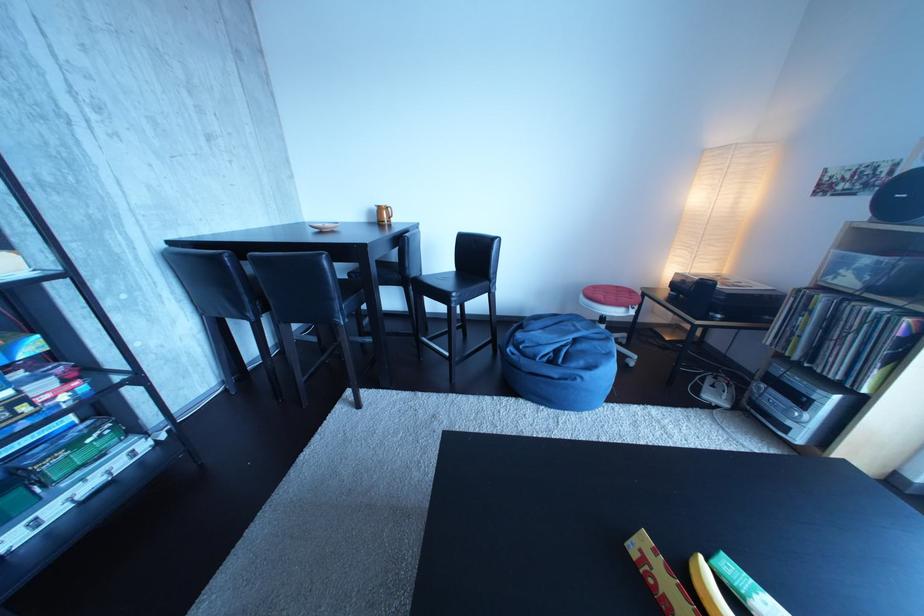
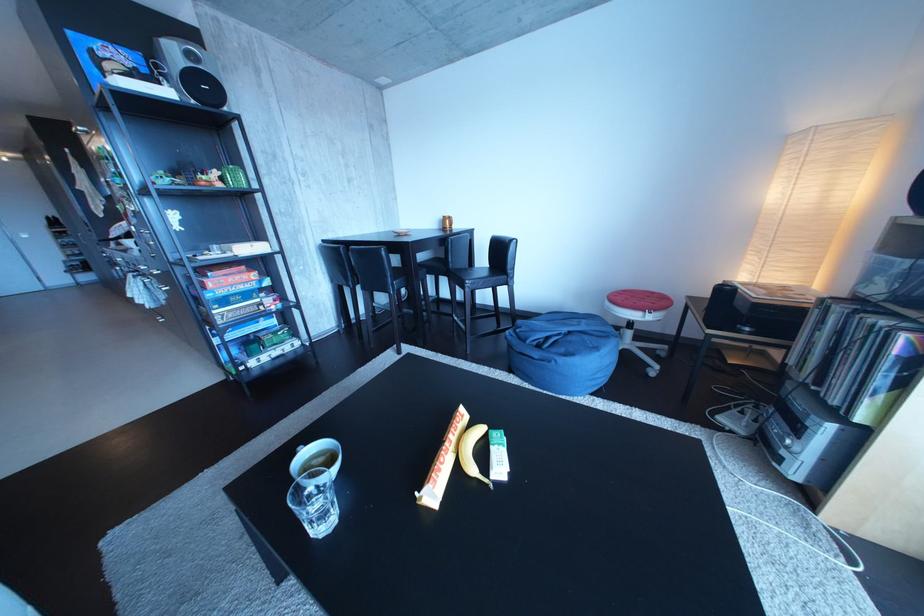
What movement of the cameraman would produce the second image?

The cameraman moved toward right, backward.